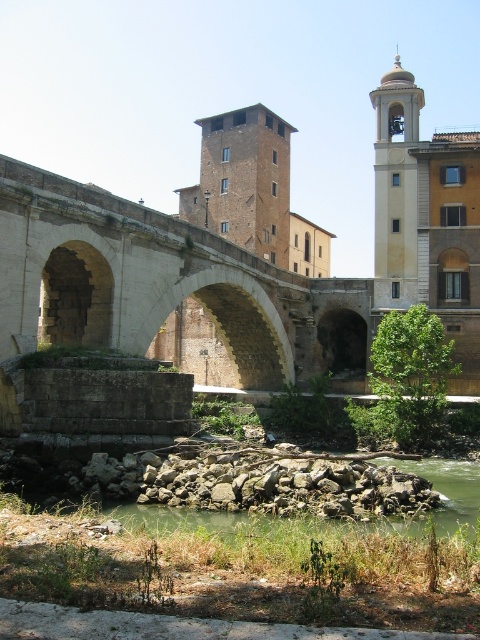
You are an architect analyzing the layout of this riverside scene. Which structure, the brown brick tower at center or the light beige stone bell tower at upper right, is positioned higher up in the image?

The light beige stone bell tower at upper right is positioned higher up in the image than the brown brick tower at center.

You are a tourist standing at the riverside and want to take a photo of both the stone arch bridge at center and the brown brick tower at center. Which object should you frame first in your camera to ensure both are fully visible in the photo?

The stone arch bridge at center is larger in size than the brown brick tower at center, so you should frame the stone arch bridge at center first to ensure both are fully visible in the photo.